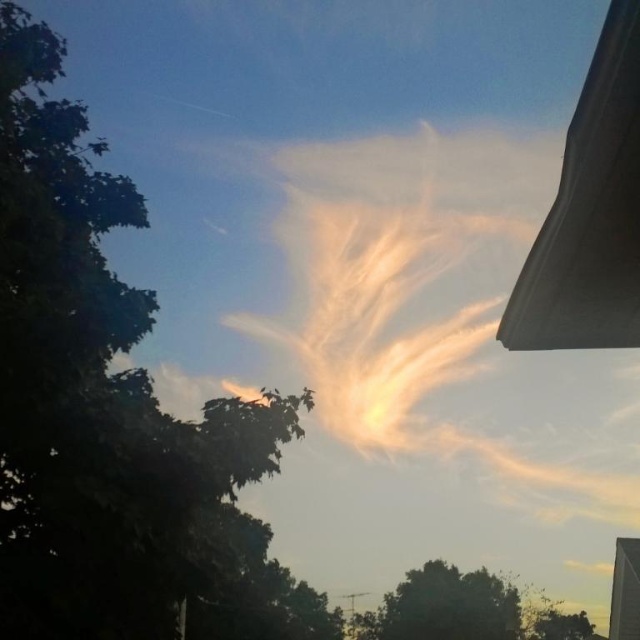
Who is shorter, green leafy tree at left or green leafy tree at lower center?

With less height is green leafy tree at lower center.

From the picture: Can you confirm if green leafy tree at left is positioned to the right of green leafy tree at lower center?

No, green leafy tree at left is not to the right of green leafy tree at lower center.

I want to click on green leafy tree at left, so click(x=113, y=413).

In the scene shown: Who is shorter, translucent cotton cloud at center or green leafy tree at lower center?

With less height is green leafy tree at lower center.

Is point (579, 474) farther from viewer compared to point (412, 621)?

That is True.

Does point (387, 177) come behind point (448, 580)?

Yes, point (387, 177) is behind point (448, 580).

Locate an element on the screen. This screenshot has height=640, width=640. translucent cotton cloud at center is located at coordinates point(419,292).

Is the position of green leafy tree at left more distant than that of translucent cotton cloud at center?

No, it is not.

Is point (148, 564) farther from camera compared to point (476, 243)?

No.

In the scene shown: Who is more forward, [20,92] or [525,188]?

Point [20,92] is in front.

What are the coordinates of `green leafy tree at left` in the screenshot? It's located at (113, 413).